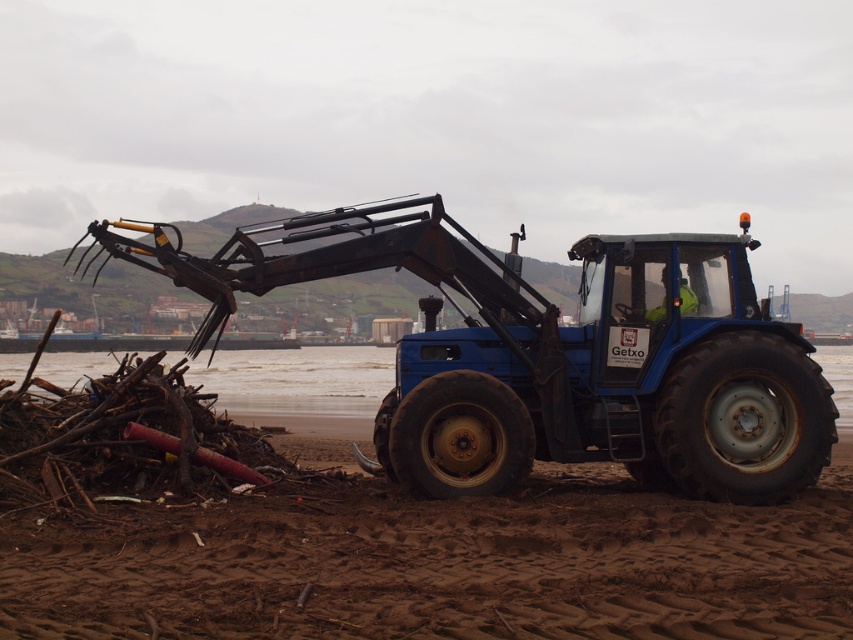
You are a maintenance worker on the beach and need to move the blue matte tractor at center to a different location. Considering the terrain of the brown sandy beach at lower center, will the tractor sink into the sand?

The brown sandy beach at lower center has a lesser height compared to blue matte tractor at center, which means the sand is not as compacted. The tractor may sink into the sand when moving, so caution is advised.

You are a beach maintenance worker who needs to move the debris pile located to the left of the tractor. Given that the blue matte tractor at center is parked on the brown sandy beach at lower center, can you safely drive the tractor directly towards the debris pile without moving it off the beach?

The brown sandy beach at lower center is to the left of blue matte tractor at center. Since the tractor is parked on the beach, driving it directly toward the debris pile to the left would keep it on the beach as the debris is also located on the same sandy area.